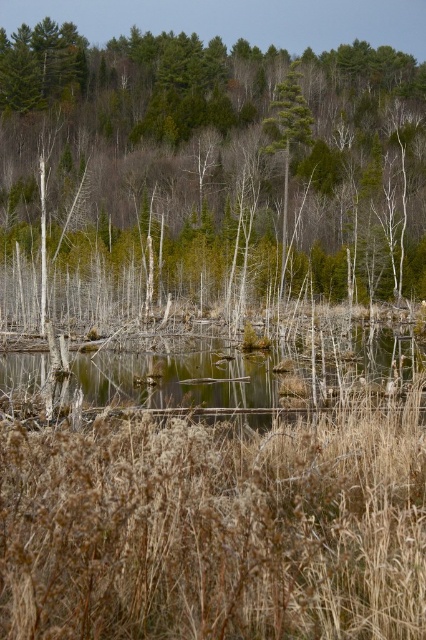
Is clear water at center positioned behind green leafy tree at center?

No.

Does clear water at center appear on the right side of green leafy tree at center?

Incorrect, clear water at center is not on the right side of green leafy tree at center.

In order to click on clear water at center in this screenshot , I will do `click(252, 372)`.

At what (x,y) coordinates should I click in order to perform the action: click on clear water at center. Please return your answer as a coordinate pair (x, y). The width and height of the screenshot is (426, 640). Looking at the image, I should click on (252, 372).

In the scene shown: Who is taller, brown wood tree at center or clear water at center?

brown wood tree at center is taller.

From the picture: Is brown wood tree at center shorter than clear water at center?

No, brown wood tree at center is not shorter than clear water at center.

You are a GUI agent. You are given a task and a screenshot of the screen. Output one action in this format:
    pyautogui.click(x=<x>, y=<y>)
    Task: Click on the brown wood tree at center
    This screenshot has width=426, height=640.
    Given the screenshot: What is the action you would take?
    pyautogui.click(x=215, y=163)

Which is above, brown wood tree at center or brown dry grass at center?

brown wood tree at center

Is point (250, 60) positioned in front of point (89, 529)?

No.

Is point (201, 172) less distant than point (365, 531)?

That is False.

Locate an element on the screen. brown wood tree at center is located at coordinates (215, 163).